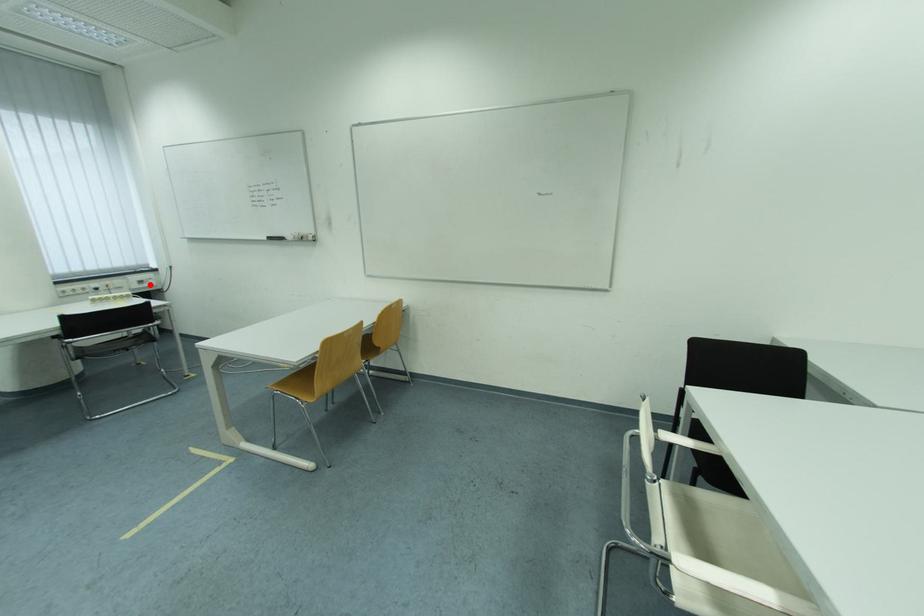
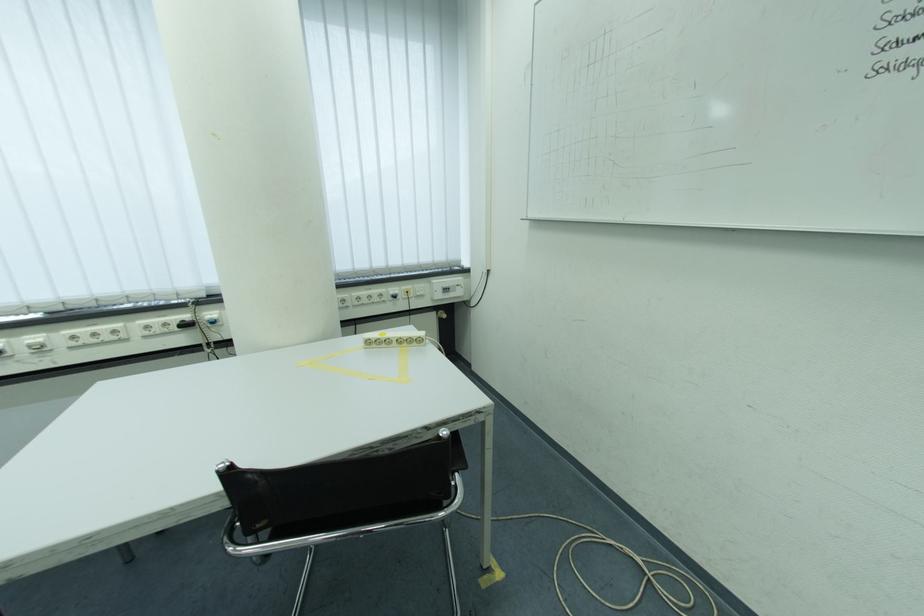
In the second image, find the point that corresponds to the highlighted location in the first image.

(455, 292)